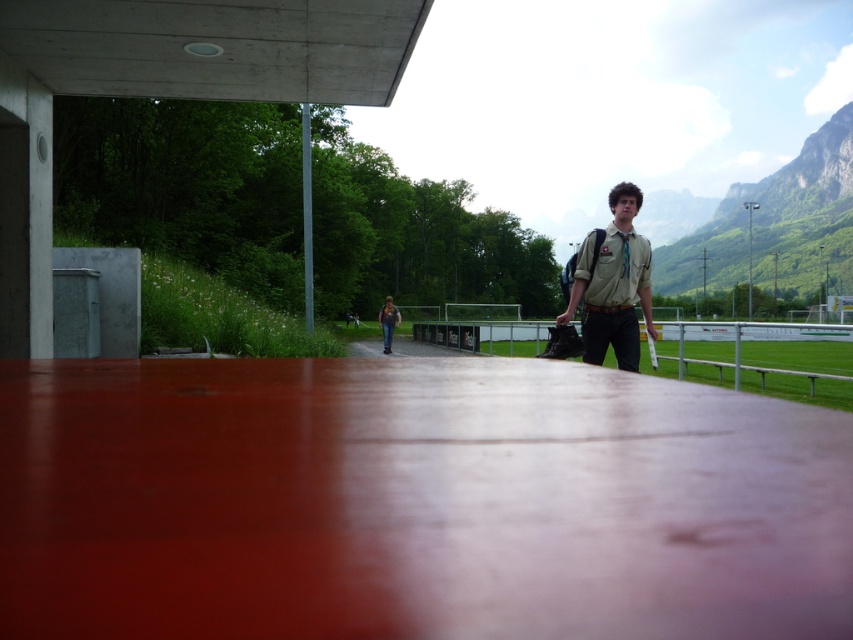
Question: Among these objects, which one is farthest from the camera?

Choices:
 (A) khaki fabric shirt at center
 (B) metallic silver rail at center

Answer: (B)

Question: Which object is closer to the camera taking this photo?

Choices:
 (A) smooth reddish-brown surface at center
 (B) khaki fabric shirt at center

Answer: (A)

Question: Does metallic silver rail at center have a lesser width compared to khaki fabric shirt at center?

Choices:
 (A) no
 (B) yes

Answer: (A)

Question: Estimate the real-world distances between objects in this image. Which object is closer to the metallic silver rail at center?

Choices:
 (A) smooth reddish-brown surface at center
 (B) khaki fabric shirt at center

Answer: (A)

Question: Is the position of metallic silver rail at center less distant than that of khaki fabric shirt at center?

Choices:
 (A) no
 (B) yes

Answer: (A)

Question: From the image, what is the correct spatial relationship of smooth reddish-brown surface at center in relation to metallic silver rail at center?

Choices:
 (A) below
 (B) above

Answer: (B)